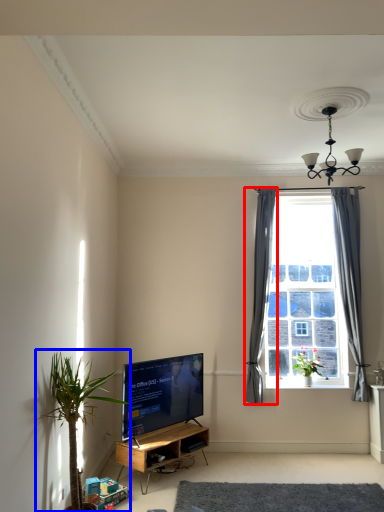
Question: Among these objects, which one is farthest to the camera, curtain (highlighted by a red box) or houseplant (highlighted by a blue box)?

Choices:
 (A) curtain
 (B) houseplant

Answer: (A)